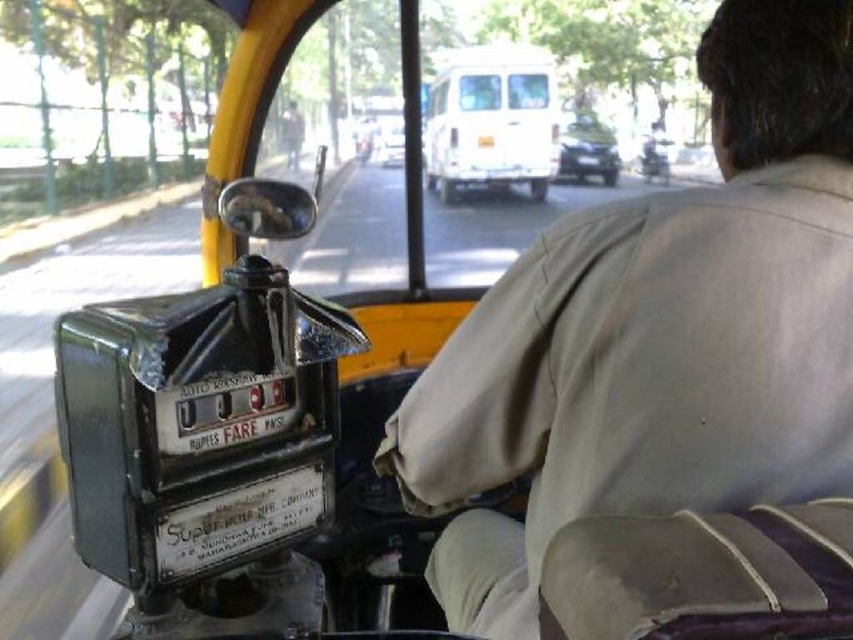
You are standing 3 meters away from the auto rickshaw. Is the point at point (x=647, y=173) inside the auto rickshaw visible to you?

The distance of point (x=647, y=173) from camera is 2.75 meters. Since you are standing 3 meters away, the point is within your visible range and thus visible.

You are a passenger in the auto rickshaw and want to know if you can safely place your backpack between the white matte bus at center and the shiny metallic motorcycle at center without it falling out. The backpack measures 18 inches in width. Can you fit it there?

The white matte bus at center and shiny metallic motorcycle at center are 21.48 inches apart from each other. Since the backpack is 18 inches wide, it can fit between them as there is enough space.

You are a passenger in the auto rickshaw and looking out the window. You see a white matte bus at center and a shiny metallic motorcycle at center. Which one is closer to you?

The white matte bus at center is closer to the viewer than the shiny metallic motorcycle at center.